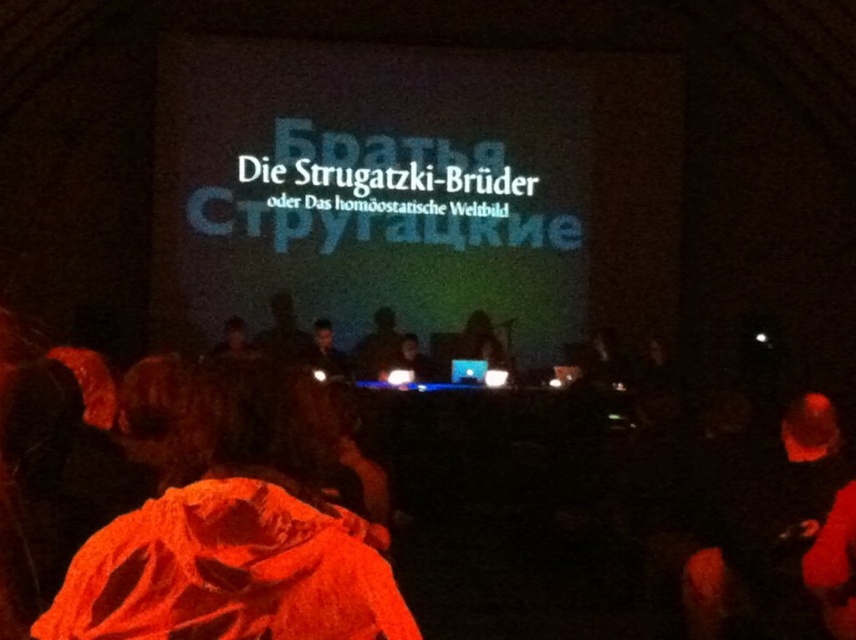
Can you confirm if smooth black laptop at center is wider than matte white screen at center?

Indeed, smooth black laptop at center has a greater width compared to matte white screen at center.

Which of these two, smooth black laptop at center or matte white screen at center, stands shorter?

matte white screen at center

The height and width of the screenshot is (640, 856). I want to click on smooth black laptop at center, so click(x=411, y=360).

The width and height of the screenshot is (856, 640). I want to click on smooth black laptop at center, so click(411, 360).